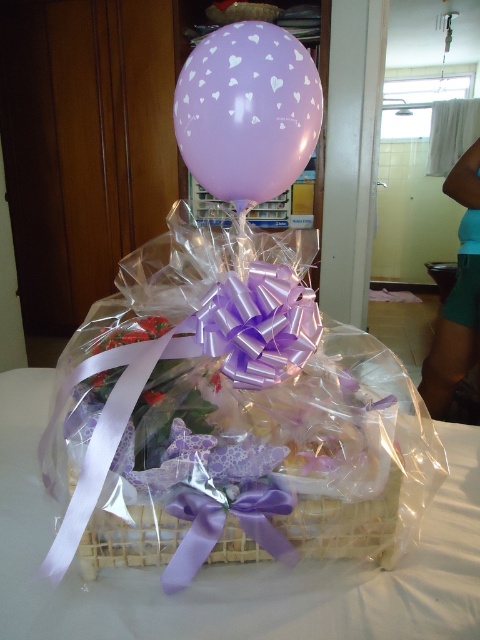
Is translucent plastic basket at center further to camera compared to lavender matte balloon at upper center?

No, translucent plastic basket at center is in front of lavender matte balloon at upper center.

Between translucent plastic basket at center and lavender matte balloon at upper center, which one has more height?

Standing taller between the two is translucent plastic basket at center.

Which is behind, point (222, 550) or point (248, 150)?

The point (248, 150) is more distant.

Identify the location of translucent plastic basket at center. (222, 451).